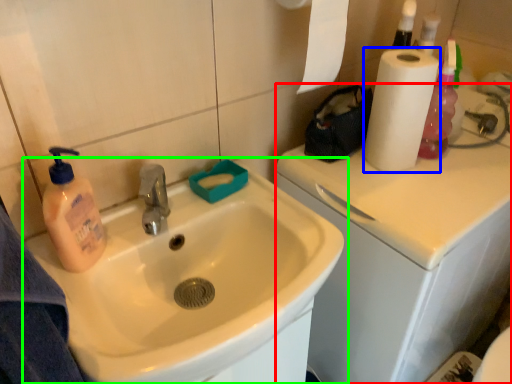
Question: Estimate the real-world distances between objects in this image. Which object is farther from counter top (highlighted by a red box), paper towel (highlighted by a blue box) or sink (highlighted by a green box)?

Choices:
 (A) paper towel
 (B) sink

Answer: (B)